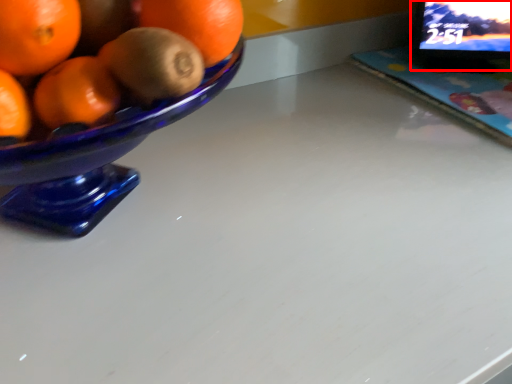
Question: Observing the image, what is the correct spatial positioning of computer monitor (annotated by the red box) in reference to laptop?

Choices:
 (A) left
 (B) right

Answer: (A)